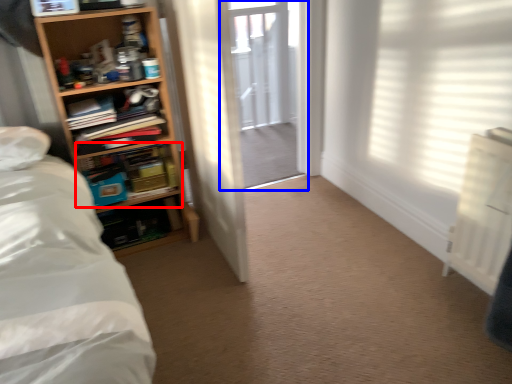
Question: Which object appears farthest to the camera in this image, shelf (highlighted by a red box) or screen door (highlighted by a blue box)?

Choices:
 (A) shelf
 (B) screen door

Answer: (B)